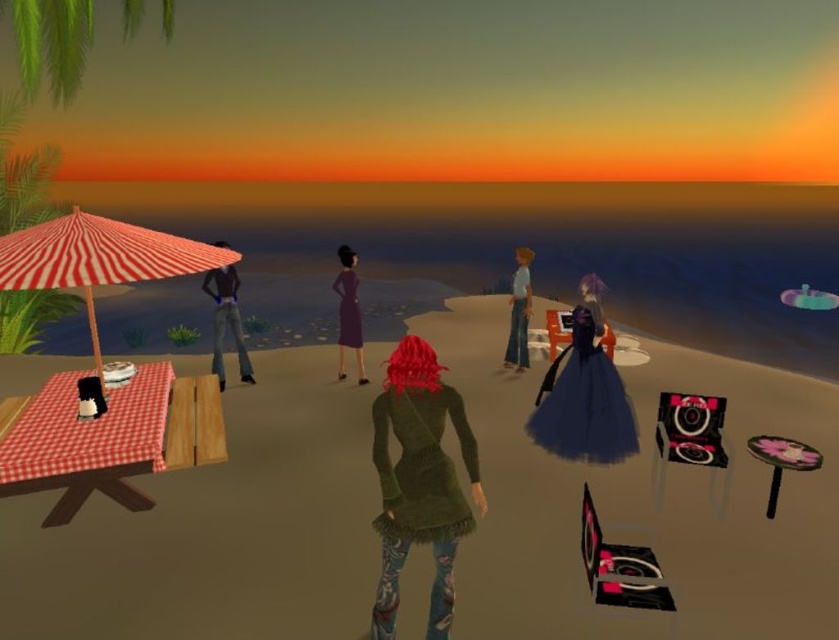
Who is taller, green fuzzy coat at center or dark blue tulle dress at center?

With more height is green fuzzy coat at center.

Measure the distance between point (407, 508) and camera.

The distance of point (407, 508) from camera is 2.85 meters.

The width and height of the screenshot is (839, 640). Find the location of `green fuzzy coat at center`. green fuzzy coat at center is located at coordinates (420, 481).

Is purple matte dress at center thinner than pink fabric stool at lower right?

Yes.

Does point (342, 349) come farther from viewer compared to point (780, 452)?

Yes, it is.

What do you see at coordinates (348, 312) in the screenshot? I see `purple matte dress at center` at bounding box center [348, 312].

At what (x,y) coordinates should I click in order to perform the action: click on purple matte dress at center. Please return your answer as a coordinate pair (x, y). Looking at the image, I should click on (348, 312).

Is point (567, 444) farther from camera compared to point (524, 330)?

No, (567, 444) is closer to viewer.

Measure the distance between dark blue tulle dress at center and camera.

The distance of dark blue tulle dress at center from camera is 5.02 meters.

Identify the location of dark blue tulle dress at center. The width and height of the screenshot is (839, 640). (582, 401).